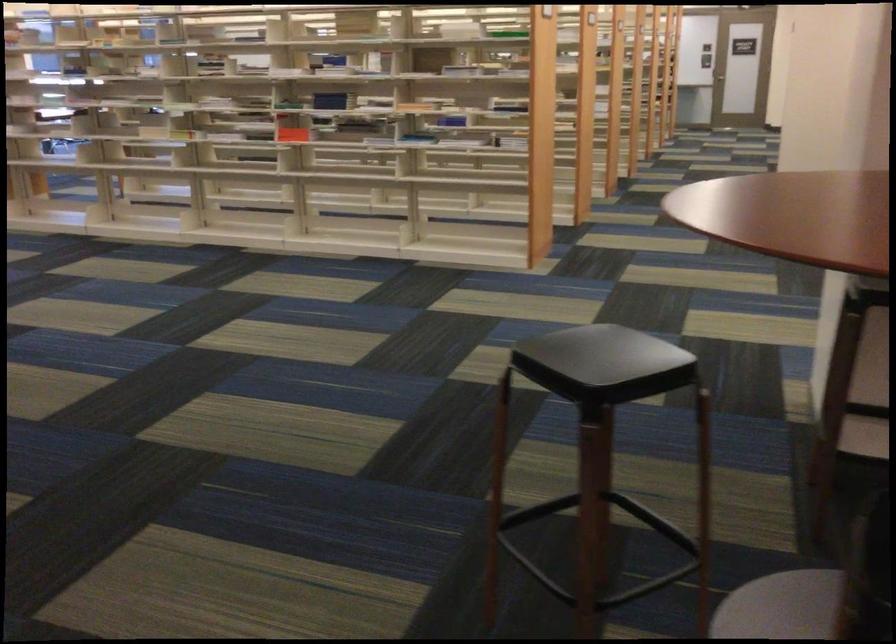
The height and width of the screenshot is (644, 896). Find the location of `door handle`. door handle is located at coordinates (713, 78).